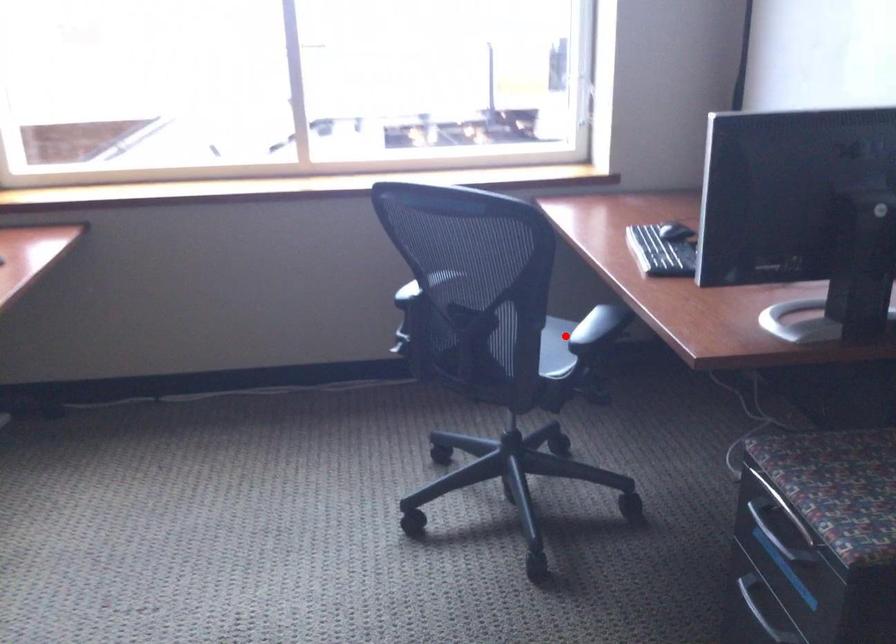
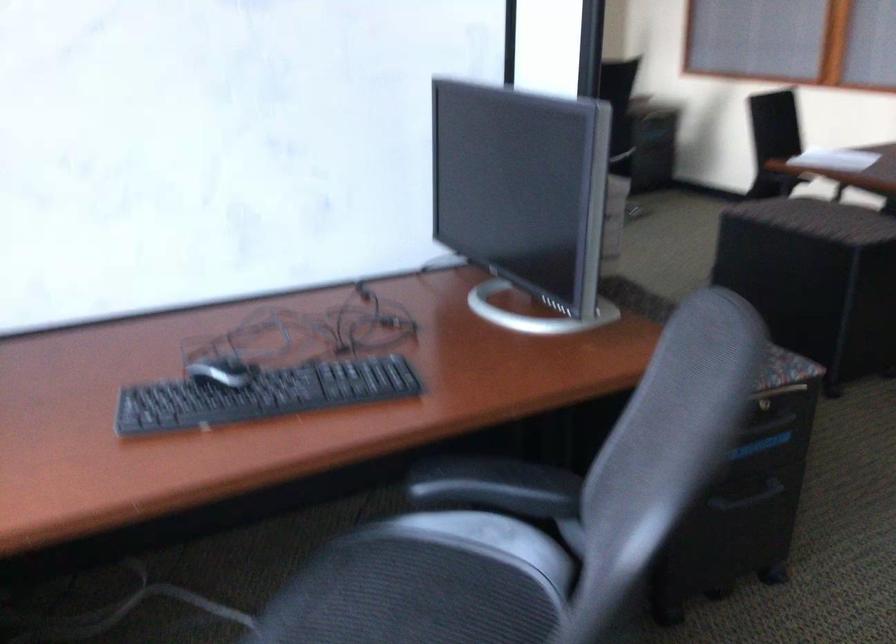
Question: I am providing you with two images of the same scene from different viewpoints. In image1, a red point is highlighted. Considering the same 3D point in image2, which of the following is correct?

Choices:
 (A) It is closer
 (B) It is farther

Answer: (A)